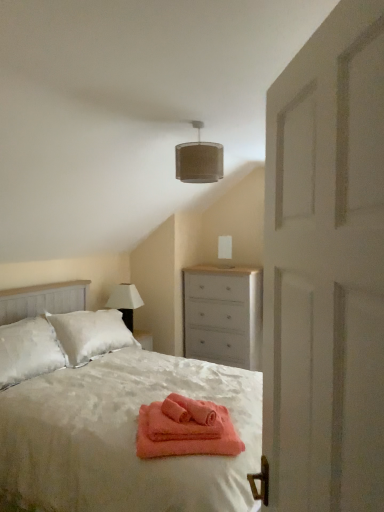
Question: Based on their sizes in the image, would you say white painted wood chest of drawers at center is bigger or smaller than white wooden door at right?

Choices:
 (A) big
 (B) small

Answer: (A)

Question: From a real-world perspective, is white painted wood chest of drawers at center physically located above or below white wooden door at right?

Choices:
 (A) below
 (B) above

Answer: (A)

Question: Considering the real-world distances, which object is closest to the beige fabric lampshade at upper center?

Choices:
 (A) white painted wood chest of drawers at center
 (B) white fabric lampshade at upper left
 (C) white wooden door at right
 (D) white satin bed at center

Answer: (D)

Question: Considering the real-world distances, which object is closest to the white fabric lampshade at upper left?

Choices:
 (A) white wooden door at right
 (B) beige fabric lampshade at upper center
 (C) white painted wood chest of drawers at center
 (D) white satin bed at center

Answer: (C)